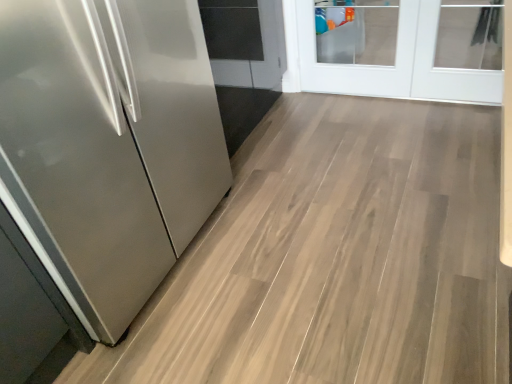
Question: Is satin stainless steel refrigerator at left inside the boundaries of white glass door at upper right, or outside?

Choices:
 (A) outside
 (B) inside

Answer: (A)

Question: Considering the positions of point (50, 256) and point (309, 18), is point (50, 256) closer or farther from the camera than point (309, 18)?

Choices:
 (A) farther
 (B) closer

Answer: (B)

Question: From their relative heights in the image, would you say satin stainless steel refrigerator at left is taller or shorter than white glass door at upper right?

Choices:
 (A) short
 (B) tall

Answer: (B)

Question: From the image's perspective, is white glass door at upper right above or below satin stainless steel refrigerator at left?

Choices:
 (A) below
 (B) above

Answer: (B)

Question: Visually, is white glass door at upper right positioned to the left or to the right of satin stainless steel refrigerator at left?

Choices:
 (A) left
 (B) right

Answer: (B)

Question: In terms of size, does white glass door at upper right appear bigger or smaller than satin stainless steel refrigerator at left?

Choices:
 (A) small
 (B) big

Answer: (A)

Question: Considering the positions of white glass door at upper right and satin stainless steel refrigerator at left in the image, is white glass door at upper right taller or shorter than satin stainless steel refrigerator at left?

Choices:
 (A) tall
 (B) short

Answer: (B)